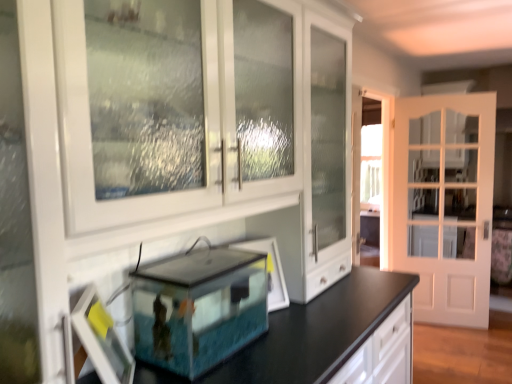
You are a GUI agent. You are given a task and a screenshot of the screen. Output one action in this format:
    pyautogui.click(x=<x>, y=<y>)
    Task: Click on the free space on the front side of white glass door at right
    
    Given the screenshot: What is the action you would take?
    pyautogui.click(x=463, y=348)